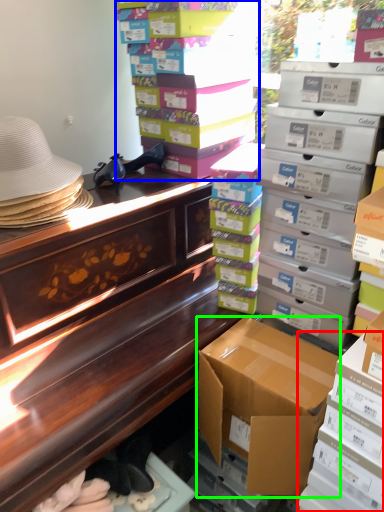
Question: Estimate the real-world distances between objects in this image. Which object is closer to box (highlighted by a red box), box (highlighted by a blue box) or box (highlighted by a green box)?

Choices:
 (A) box
 (B) box

Answer: (B)